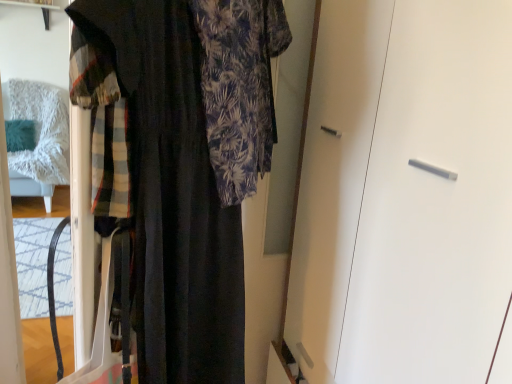
Question: From the image's perspective, is white matte cabinet at center positioned above or below dark blue textured dress at left?

Choices:
 (A) below
 (B) above

Answer: (A)

Question: Do you think white matte cabinet at center is within dark blue textured dress at left, or outside of it?

Choices:
 (A) inside
 (B) outside

Answer: (B)

Question: Is white matte cabinet at center to the left or to the right of dark blue textured dress at left in the image?

Choices:
 (A) right
 (B) left

Answer: (A)

Question: From the image's perspective, relative to white matte cabinet at center, is dark blue textured dress at left above or below?

Choices:
 (A) above
 (B) below

Answer: (A)

Question: Is dark blue textured dress at left taller or shorter than white matte cabinet at center?

Choices:
 (A) short
 (B) tall

Answer: (A)

Question: Considering the positions of point (231, 304) and point (459, 185), is point (231, 304) closer or farther from the camera than point (459, 185)?

Choices:
 (A) closer
 (B) farther

Answer: (B)

Question: Relative to white matte cabinet at center, is dark blue textured dress at left in front or behind?

Choices:
 (A) behind
 (B) front

Answer: (B)